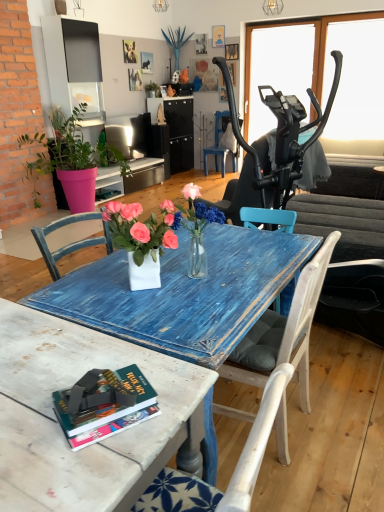
Describe the element at coordinates (283, 332) in the screenshot. I see `white painted wood chair at center, which is counted as the 1th chair, starting from the bottom` at that location.

Locate an element on the screen. The image size is (384, 512). white glossy vase at center is located at coordinates (143, 238).

You are a GUI agent. You are given a task and a screenshot of the screen. Output one action in this format:
    pyautogui.click(x=<x>, y=<y>)
    Task: Click on the hardcover book at lower left
    
    Given the screenshot: What is the action you would take?
    pyautogui.click(x=104, y=405)

This screenshot has height=512, width=384. Describe the element at coordinates (104, 405) in the screenshot. I see `hardcover book at lower left` at that location.

The image size is (384, 512). Find the location of `blue textured vase at upper center`. blue textured vase at upper center is located at coordinates (176, 42).

The height and width of the screenshot is (512, 384). I want to click on white painted wood chair at center, placed as the 1th chair when sorted from front to back, so pos(283,332).

How different are the orientations of pink plastic pot at left, which is counted as the 1th houseplant, starting from the bottom, and blue textured vase at upper center in degrees?

There is a 0.155-degree angle between the facing directions of pink plastic pot at left, which is counted as the 1th houseplant, starting from the bottom, and blue textured vase at upper center.

Choose the correct answer: Is pink plastic pot at left, the 2th houseplant in the top-to-bottom sequence, inside blue textured vase at upper center or outside it?

pink plastic pot at left, the 2th houseplant in the top-to-bottom sequence, exists outside the volume of blue textured vase at upper center.

From the image's perspective, between pink plastic pot at left, acting as the second houseplant starting from the back, and blue textured vase at upper center, which one is located above?

blue textured vase at upper center.

From the hardcover book at lower left, count 2nd chairs backward and point to it. Please provide its 2D coordinates.

[(217, 144)]

From a real-world perspective, is hardcover book at lower left on blue painted wood chair at center, the second chair positioned from the bottom?

Yes, from a real-world perspective, hardcover book at lower left is on top of blue painted wood chair at center, the second chair positioned from the bottom.

Considering the positions of objects hardcover book at lower left and blue painted wood chair at center, acting as the second chair starting from the front, in the image provided, who is more to the right, hardcover book at lower left or blue painted wood chair at center, acting as the second chair starting from the front,?

From the viewer's perspective, blue painted wood chair at center, acting as the second chair starting from the front, appears more on the right side.

Can you confirm if hardcover book at lower left is wider than blue painted wood chair at center, acting as the second chair starting from the front?

No, hardcover book at lower left is not wider than blue painted wood chair at center, acting as the second chair starting from the front.

Between green matte plant at upper center, the second houseplant positioned from the bottom, and hardcover book at lower left, which one has larger width?

Wider between the two is hardcover book at lower left.

In the scene shown: Are green matte plant at upper center, the second houseplant positioned from the front, and hardcover book at lower left located far from each other?

Yes, green matte plant at upper center, the second houseplant positioned from the front, is far from hardcover book at lower left.

Can we say green matte plant at upper center, the second houseplant positioned from the front, lies outside hardcover book at lower left?

green matte plant at upper center, the second houseplant positioned from the front, lies outside hardcover book at lower left's area.

You are a GUI agent. You are given a task and a screenshot of the screen. Output one action in this format:
    pyautogui.click(x=<x>, y=<y>)
    Task: Click on the chair that is the 1st object directly below the transparent glass window screen at upper right (from a real-world perspective)
    This screenshot has width=384, height=512.
    Given the screenshot: What is the action you would take?
    pyautogui.click(x=217, y=144)

Considering the relative sizes of blue painted wood chair at center, acting as the second chair starting from the front, and transparent glass window screen at upper right in the image provided, is blue painted wood chair at center, acting as the second chair starting from the front, wider than transparent glass window screen at upper right?

Yes, blue painted wood chair at center, acting as the second chair starting from the front, is wider than transparent glass window screen at upper right.

From the image's perspective, which one is positioned higher, blue painted wood chair at center, the second chair positioned from the bottom, or transparent glass window screen at upper right?

transparent glass window screen at upper right is shown above in the image.

Can you tell me how much blue painted wood chair at center, marked as the 1th chair in a top-to-bottom arrangement, and transparent glass window screen at upper right differ in facing direction?

The angle between the facing direction of blue painted wood chair at center, marked as the 1th chair in a top-to-bottom arrangement, and the facing direction of transparent glass window screen at upper right is 0.889 degrees.

Starting from the white distressed wood table at center, which houseplant is the 1st one to the left? Please provide its 2D coordinates.

[(153, 88)]

Between green matte plant at upper center, marked as the 1th houseplant in a back-to-front arrangement, and white distressed wood table at center, which one is positioned behind?

Positioned behind is green matte plant at upper center, marked as the 1th houseplant in a back-to-front arrangement.

Which object is wider, green matte plant at upper center, acting as the first houseplant starting from the top, or white distressed wood table at center?

white distressed wood table at center.

What's the angular difference between white distressed wood table at center and pink plastic pot at left, which is the first houseplant from front to back,'s facing directions?

178 degrees.

In the scene shown: Considering the relative sizes of white distressed wood table at center and pink plastic pot at left, acting as the second houseplant starting from the back, in the image provided, is white distressed wood table at center smaller than pink plastic pot at left, acting as the second houseplant starting from the back,?

Correct, white distressed wood table at center occupies less space than pink plastic pot at left, acting as the second houseplant starting from the back.

From the image's perspective, does white distressed wood table at center appear lower than pink plastic pot at left, the 2th houseplant in the top-to-bottom sequence?

Answer: Yes, from the image's perspective, white distressed wood table at center is beneath pink plastic pot at left, the 2th houseplant in the top-to-bottom sequence.

Which object is wider, blue textured vase at upper center or hardcover book at lower left?

blue textured vase at upper center is wider.

Who is smaller, blue textured vase at upper center or hardcover book at lower left?

hardcover book at lower left.

Considering the points (187, 39) and (104, 383), which point is behind, point (187, 39) or point (104, 383)?

The point (187, 39) is farther from the camera.

Identify the location of plant above the pink plastic pot at left, the 2th houseplant in the top-to-bottom sequence (from a real-world perspective). (176, 42).

This screenshot has height=512, width=384. What are the coordinates of `chair that is the 2nd one when counting backward from the hardcover book at lower left` in the screenshot? It's located at point(217,144).

Which object lies further to the anchor point white glossy vase at center, transparent glass window screen at upper right or pink plastic pot at left, acting as the second houseplant starting from the back?

transparent glass window screen at upper right.

Considering their positions, is pink plastic pot at left, which is the first houseplant from front to back, positioned closer to transparent glass window screen at upper right than blue painted wood chair at center, the second chair positioned from the bottom?

Among the two, blue painted wood chair at center, the second chair positioned from the bottom, is located nearer to transparent glass window screen at upper right.

When comparing their distances from blue painted wood chair at center, acting as the second chair starting from the front, does white glossy vase at center or green matte plant at upper center, acting as the first houseplant starting from the top, seem closer?

The object closer to blue painted wood chair at center, acting as the second chair starting from the front, is green matte plant at upper center, acting as the first houseplant starting from the top.

Based on their spatial positions, is white distressed wood table at center or white painted wood chair at center, which is counted as the 1th chair, starting from the bottom, closer to blue textured vase at upper center?

white painted wood chair at center, which is counted as the 1th chair, starting from the bottom, is positioned closer to the anchor blue textured vase at upper center.

Estimate the real-world distances between objects in this image. Which object is closer to blue textured vase at upper center, blue painted wood chair at center, the second chair positioned from the bottom, or white distressed wood table at center?

Based on the image, blue painted wood chair at center, the second chair positioned from the bottom, appears to be nearer to blue textured vase at upper center.

Looking at the image, which one is located closer to hardcover book at lower left, white distressed wood table at center or blue textured vase at upper center?

Based on the image, white distressed wood table at center appears to be nearer to hardcover book at lower left.

Estimate the real-world distances between objects in this image. Which object is closer to transparent glass window screen at upper right, green matte plant at upper center, acting as the first houseplant starting from the top, or blue textured vase at upper center?

Based on the image, blue textured vase at upper center appears to be nearer to transparent glass window screen at upper right.

Considering their positions, is white painted wood chair at center, which appears as the second chair when viewed from the back, positioned closer to blue textured vase at upper center than blue painted wood chair at center, marked as the 1th chair in a top-to-bottom arrangement?

blue painted wood chair at center, marked as the 1th chair in a top-to-bottom arrangement, is positioned closer to the anchor blue textured vase at upper center.

Where is `houseplant positioned between white glossy vase at center and green matte plant at upper center, the second houseplant positioned from the bottom, from near to far`? The width and height of the screenshot is (384, 512). houseplant positioned between white glossy vase at center and green matte plant at upper center, the second houseplant positioned from the bottom, from near to far is located at coordinates (71, 159).

I want to click on book between white glossy vase at center and white distressed wood table at center in the up-down direction, so click(x=104, y=405).

Locate an element on the screen. floral arrangement between hardcover book at lower left and blue textured vase at upper center along the z-axis is located at coordinates (143, 238).

Where is `window screen positioned between hardcover book at lower left and blue textured vase at upper center from near to far`? This screenshot has height=512, width=384. window screen positioned between hardcover book at lower left and blue textured vase at upper center from near to far is located at coordinates (276, 70).